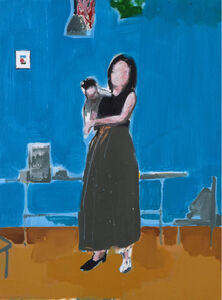
Find the location of a particular element. This screenshot has width=222, height=300. blurry acrylic painting image is located at coordinates (111, 46).